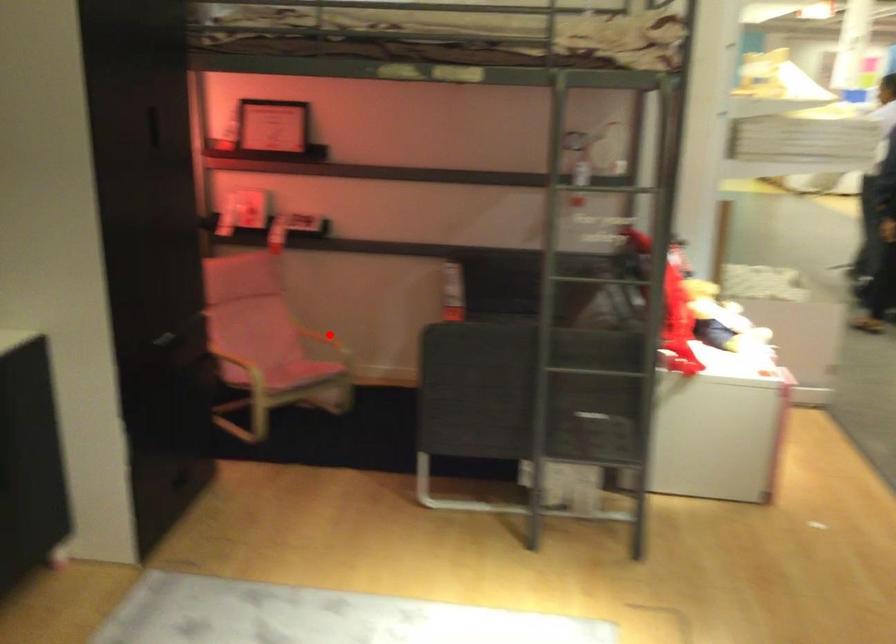
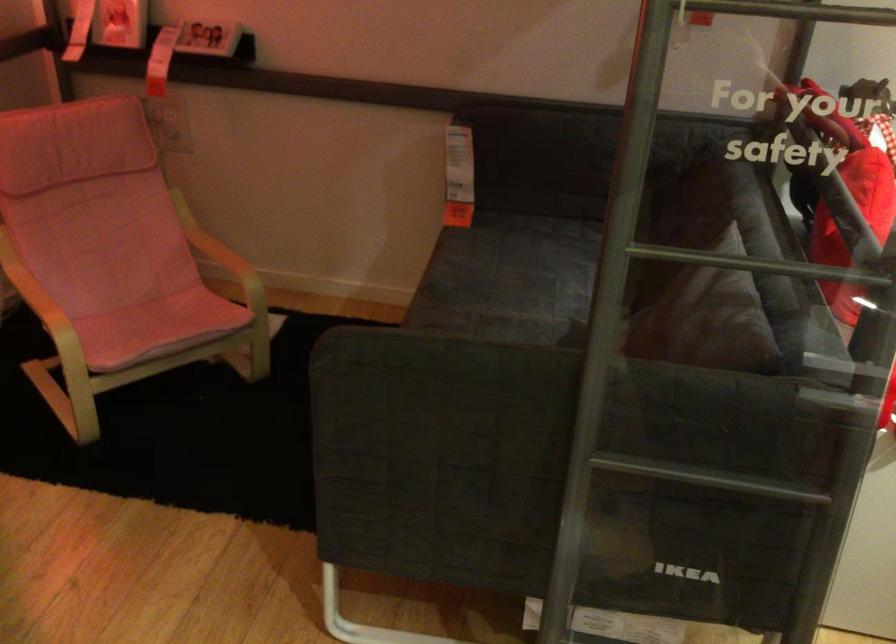
The point at the highlighted location is marked in the first image. Where is the corresponding point in the second image?

(220, 252)